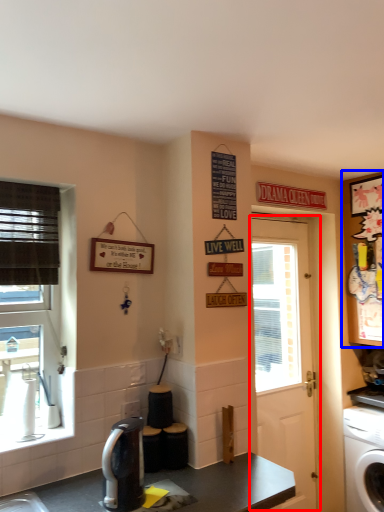
Question: Which object appears farthest to the camera in this image, door (highlighted by a red box) or cabinetry (highlighted by a blue box)?

Choices:
 (A) door
 (B) cabinetry

Answer: (B)